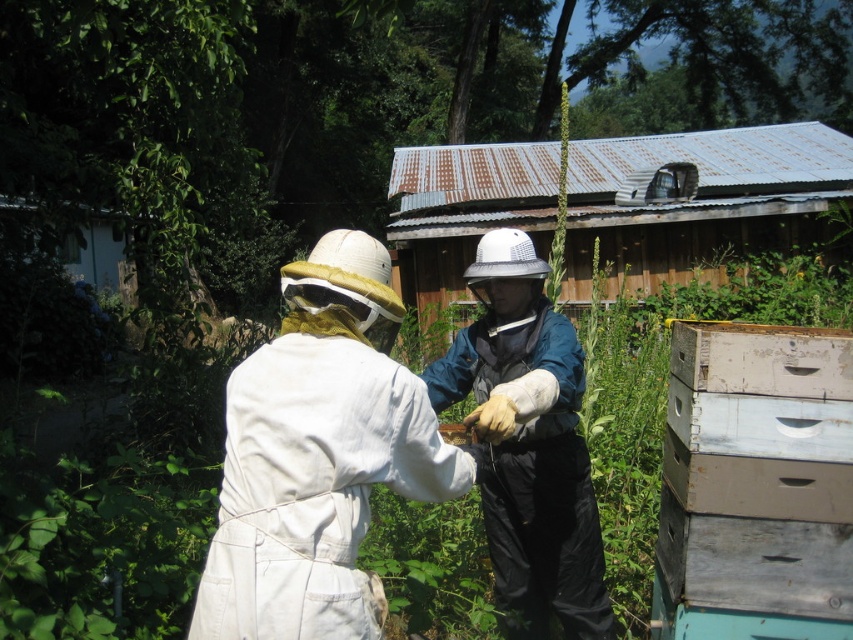
Question: Which object is the closest to the rusty corrugated metal hut at upper center?

Choices:
 (A) white cotton beekeeper suit at center
 (B) weathered wood beehive at right

Answer: (B)

Question: Which is nearer to the white cotton beekeeper suit at center?

Choices:
 (A) weathered wood beehive at right
 (B) teal fabric vest at center
 (C) rusty corrugated metal hut at upper center

Answer: (B)

Question: Considering the relative positions of white cotton beekeeper suit at center and rusty corrugated metal hut at upper center in the image provided, where is white cotton beekeeper suit at center located with respect to rusty corrugated metal hut at upper center?

Choices:
 (A) left
 (B) right

Answer: (A)

Question: Can you confirm if rusty corrugated metal hut at upper center is bigger than teal fabric vest at center?

Choices:
 (A) no
 (B) yes

Answer: (B)

Question: Which point is closer to the camera?

Choices:
 (A) teal fabric vest at center
 (B) white cotton beekeeper suit at center

Answer: (B)

Question: Can you confirm if white cotton beekeeper suit at center is positioned to the left of rusty corrugated metal hut at upper center?

Choices:
 (A) yes
 (B) no

Answer: (A)